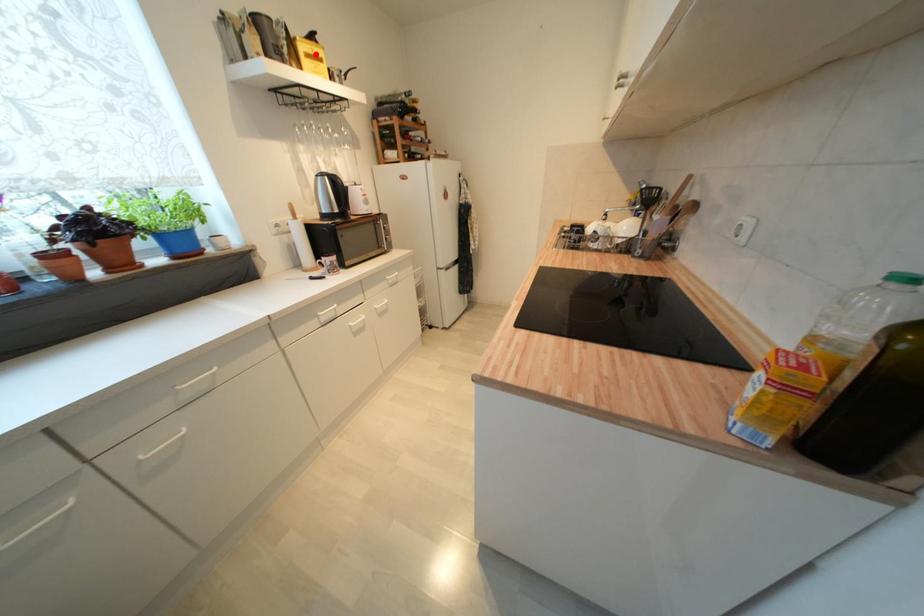
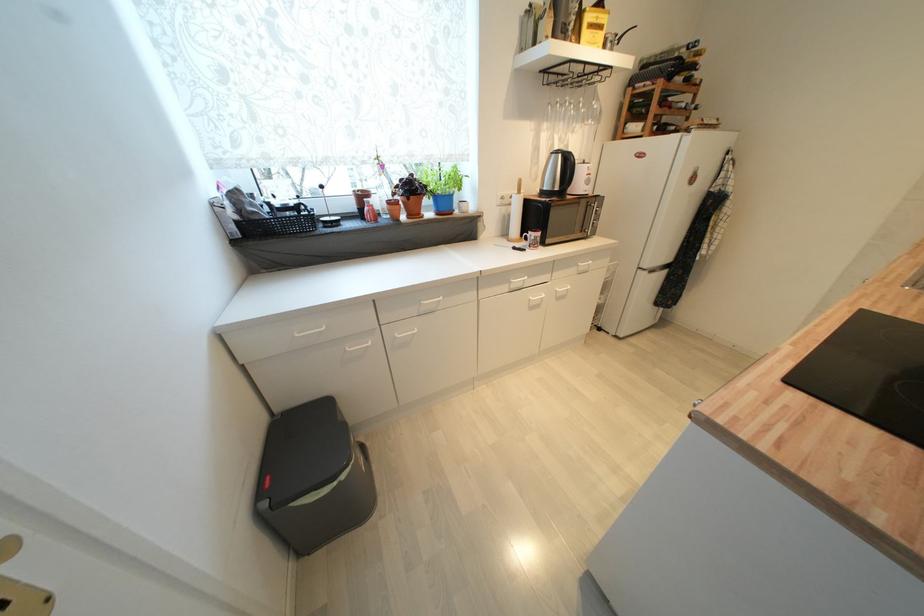
In the second image, find the point that corresponds to the highlighted location in the first image.

(600, 23)